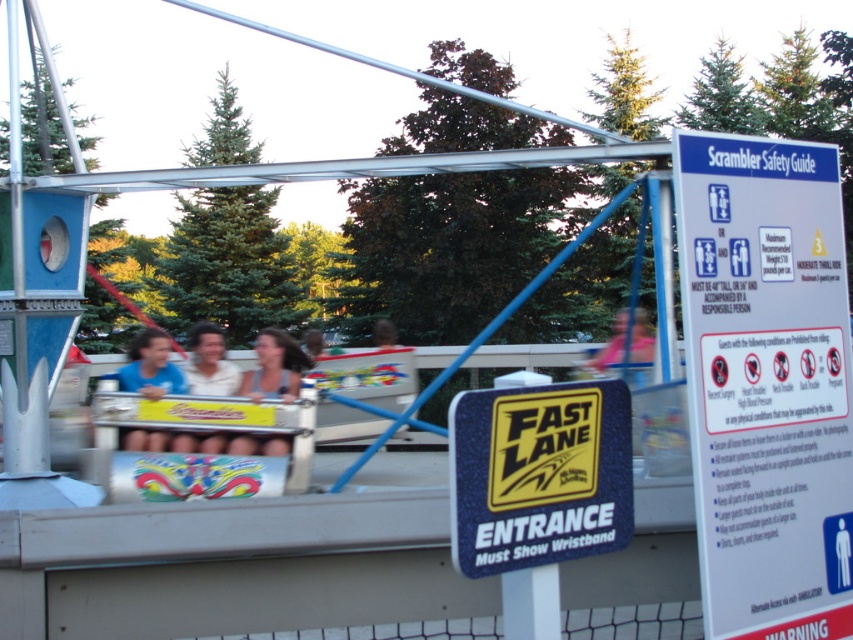
You are standing at the FAST LANE ENTRANCE sign and want to find a person wearing a matte blue shirt at center. In which direction should you look relative to the sign?

You should look towards the center of the image where the matte blue shirt at center is located at point [149,365].